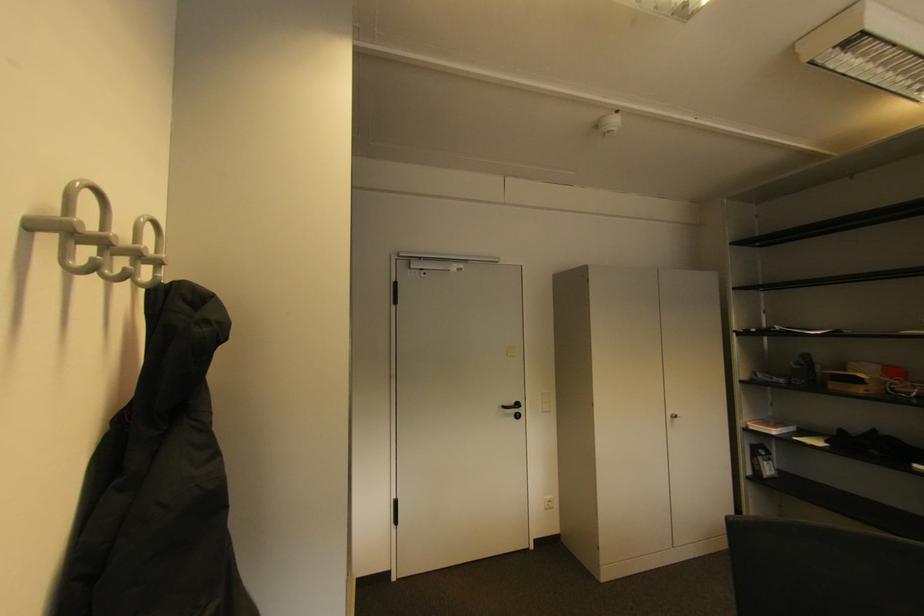
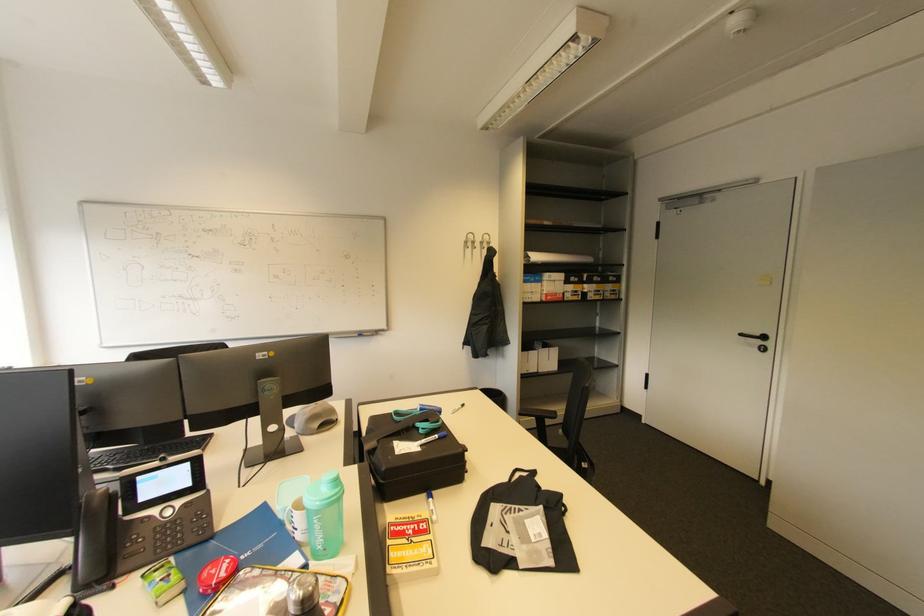
The point at [523,406] is marked in the first image. Where is the corresponding point in the second image?

(769, 339)